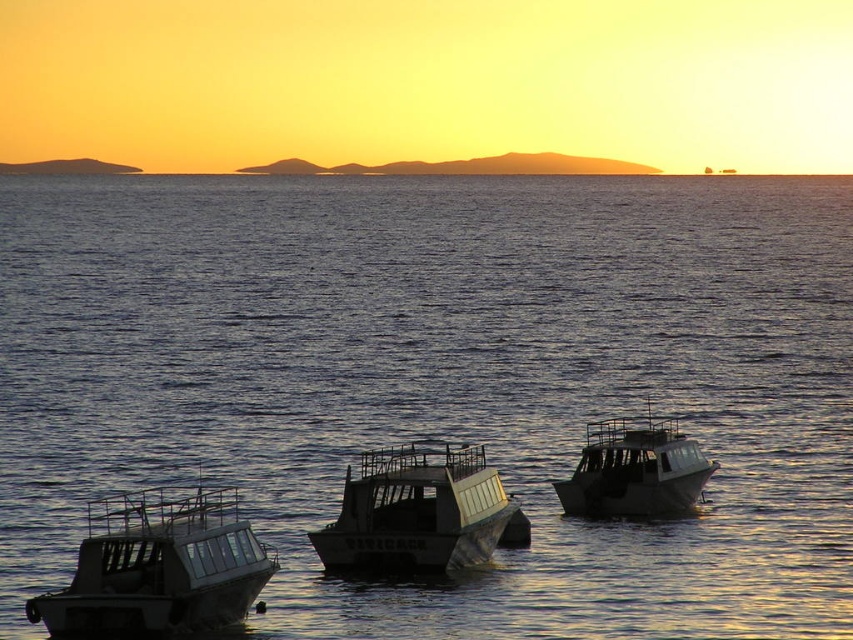
You are a marine biologist who needs to board a boat to collect water samples. You are currently standing on the dock and see the metallic gray boat at lower left and the metallic gray boat at right. Which boat is closer to the dock?

The metallic gray boat at lower left is closer to the dock since it is only 27.16 feet away from the metallic gray boat at right, but without knowing the exact distance from each boat to the dock, we cannot determine which is closer. Please provide more information about their positions relative to the dock.

You are a photographer planning to capture the sunset with both the metallic gray boat at center and the metallic gray boat at right in the frame. Which boat should you position closer to the center of your camera viewfinder to ensure both are visible without cropping?

You should position the metallic gray boat at center closer to the center of your camera viewfinder because it occupies less space than the metallic gray boat at right, allowing more room for both boats in the frame.

In the scene shown: You are a photographer planning to capture the sunset with both the dark blue water at center and the metallic gray boat at center in your shot. Which object will occupy more horizontal space in the photo?

The dark blue water at center has a greater width than the metallic gray boat at center, so it will occupy more horizontal space in the photo.